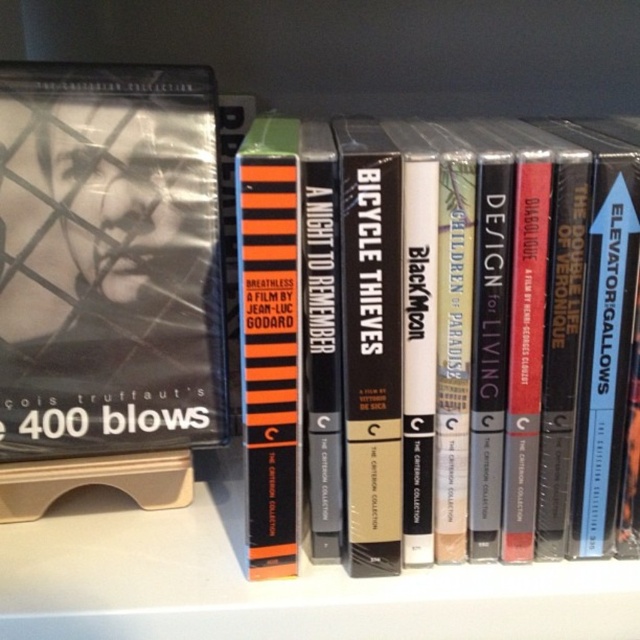
Which is more to the right, black matte book at center or orange striped book at center?

Positioned to the right is black matte book at center.

Is black matte book at center thinner than orange striped book at center?

No.

Does point (572, 275) lie in front of point (260, 513)?

That is True.

Where is `black matte book at center`? This screenshot has height=640, width=640. black matte book at center is located at coordinates (467, 330).